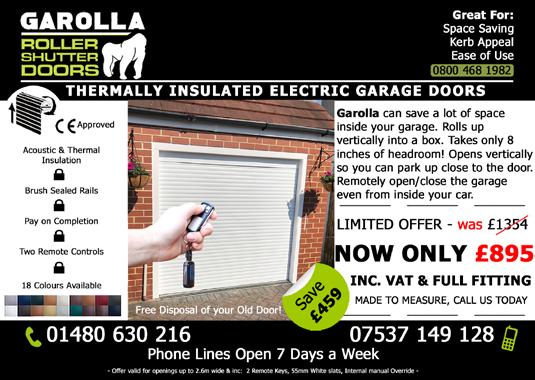
This screenshot has width=535, height=380. Find the location of `hanging bracket`. hanging bracket is located at coordinates (129, 134), (319, 156), (328, 156), (129, 147).